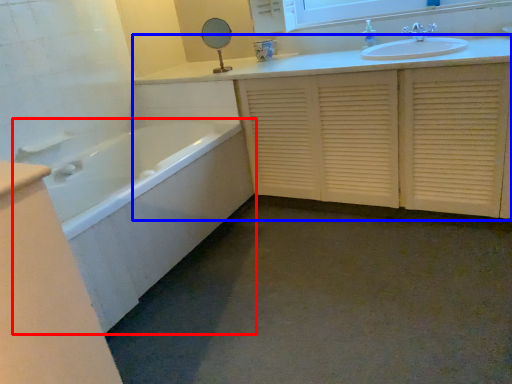
Question: Which object appears closest to the camera in this image, bathtub (highlighted by a red box) or bathroom cabinet (highlighted by a blue box)?

Choices:
 (A) bathtub
 (B) bathroom cabinet

Answer: (A)